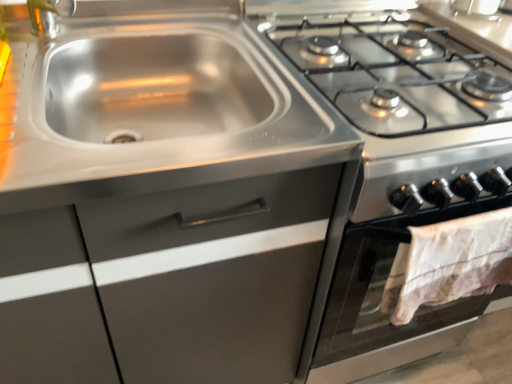
Question: Is stainless steel stove at upper right completely or partially inside stainless steel cabinet at upper left?

Choices:
 (A) yes
 (B) no

Answer: (B)

Question: Considering the relative sizes of stainless steel cabinet at upper left and stainless steel stove at upper right in the image provided, is stainless steel cabinet at upper left wider than stainless steel stove at upper right?

Choices:
 (A) no
 (B) yes

Answer: (A)

Question: Does stainless steel cabinet at upper left have a lesser width compared to stainless steel stove at upper right?

Choices:
 (A) yes
 (B) no

Answer: (A)

Question: From the image's perspective, is stainless steel cabinet at upper left below stainless steel stove at upper right?

Choices:
 (A) yes
 (B) no

Answer: (A)

Question: From the image's perspective, would you say stainless steel cabinet at upper left is positioned over stainless steel stove at upper right?

Choices:
 (A) yes
 (B) no

Answer: (B)

Question: In terms of width, does stainless steel stove at upper right look wider or thinner when compared to stainless steel sink at upper left?

Choices:
 (A) wide
 (B) thin

Answer: (A)

Question: Is stainless steel stove at upper right taller or shorter than stainless steel sink at upper left?

Choices:
 (A) tall
 (B) short

Answer: (A)

Question: Looking at the image, does stainless steel stove at upper right seem bigger or smaller compared to stainless steel sink at upper left?

Choices:
 (A) small
 (B) big

Answer: (B)

Question: Based on their positions, is stainless steel stove at upper right located to the left or right of stainless steel sink at upper left?

Choices:
 (A) left
 (B) right

Answer: (B)

Question: Looking at their shapes, would you say stainless steel cabinet at upper left is wider or thinner than stainless steel stove at upper right?

Choices:
 (A) thin
 (B) wide

Answer: (A)

Question: Is stainless steel cabinet at upper left to the left or to the right of stainless steel stove at upper right in the image?

Choices:
 (A) left
 (B) right

Answer: (A)

Question: Based on their sizes in the image, would you say stainless steel cabinet at upper left is bigger or smaller than stainless steel stove at upper right?

Choices:
 (A) small
 (B) big

Answer: (B)

Question: Is stainless steel cabinet at upper left inside the boundaries of stainless steel stove at upper right, or outside?

Choices:
 (A) outside
 (B) inside

Answer: (A)

Question: Considering the positions of stainless steel sink at upper left and stainless steel cabinet at upper left in the image, is stainless steel sink at upper left taller or shorter than stainless steel cabinet at upper left?

Choices:
 (A) short
 (B) tall

Answer: (A)

Question: From a real-world perspective, is stainless steel sink at upper left above or below stainless steel cabinet at upper left?

Choices:
 (A) above
 (B) below

Answer: (A)